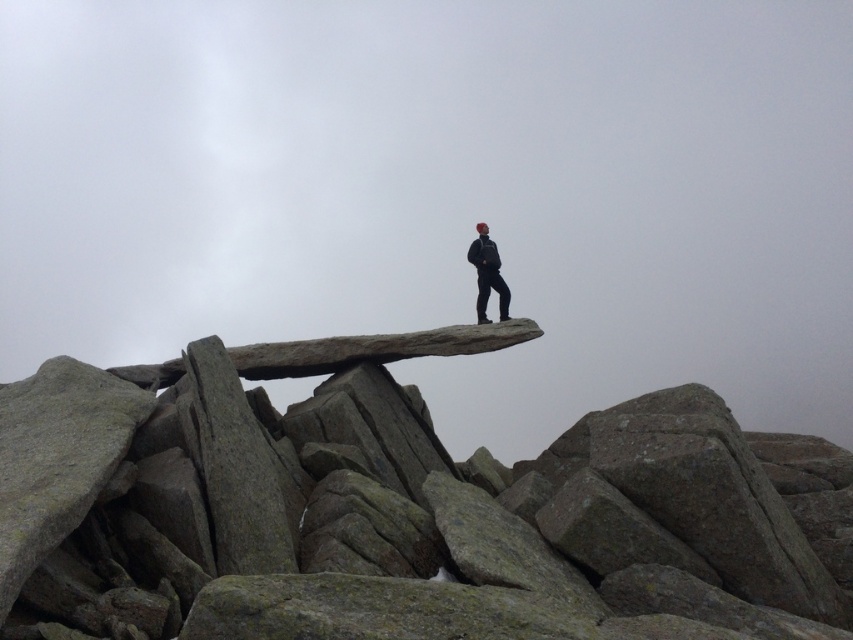
Question: Which point is farther from the camera taking this photo?

Choices:
 (A) (479, 248)
 (B) (556, 621)

Answer: (A)

Question: Which of the following is the farthest from the observer?

Choices:
 (A) (479, 307)
 (B) (795, 499)

Answer: (A)

Question: Is gray granite rock at center wider than dark gray fabric jacket at center?

Choices:
 (A) no
 (B) yes

Answer: (B)

Question: Which point is closer to the camera?

Choices:
 (A) (476, 259)
 (B) (4, 483)

Answer: (B)

Question: Is gray granite rock at center above dark gray fabric jacket at center?

Choices:
 (A) yes
 (B) no

Answer: (B)

Question: Does gray granite rock at center have a greater width compared to dark gray fabric jacket at center?

Choices:
 (A) yes
 (B) no

Answer: (A)